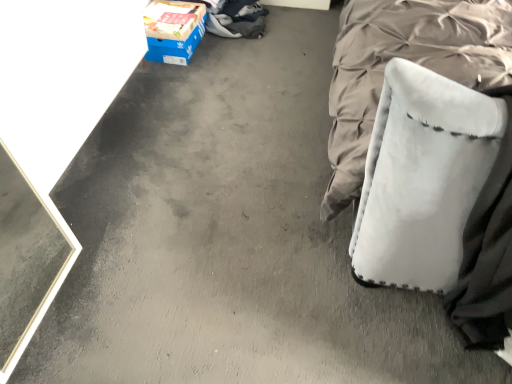
Question: Can you confirm if white fabric swivel chair at right is bigger than blue cardboard box at upper left?

Choices:
 (A) no
 (B) yes

Answer: (B)

Question: Does white fabric swivel chair at right come in front of blue cardboard box at upper left?

Choices:
 (A) yes
 (B) no

Answer: (A)

Question: Does white fabric swivel chair at right lie behind blue cardboard box at upper left?

Choices:
 (A) yes
 (B) no

Answer: (B)

Question: Is white fabric swivel chair at right touching blue cardboard box at upper left?

Choices:
 (A) no
 (B) yes

Answer: (A)

Question: Is white fabric swivel chair at right smaller than blue cardboard box at upper left?

Choices:
 (A) no
 (B) yes

Answer: (A)

Question: From the image's perspective, is white fabric swivel chair at right above blue cardboard box at upper left?

Choices:
 (A) no
 (B) yes

Answer: (A)

Question: Does blue cardboard box at upper left come in front of white fabric swivel chair at right?

Choices:
 (A) yes
 (B) no

Answer: (B)

Question: Considering the relative sizes of blue cardboard box at upper left and white fabric swivel chair at right in the image provided, is blue cardboard box at upper left wider than white fabric swivel chair at right?

Choices:
 (A) no
 (B) yes

Answer: (A)

Question: From the image's perspective, does blue cardboard box at upper left appear lower than white fabric swivel chair at right?

Choices:
 (A) yes
 (B) no

Answer: (B)

Question: Is blue cardboard box at upper left turned away from white fabric swivel chair at right?

Choices:
 (A) no
 (B) yes

Answer: (A)

Question: Is blue cardboard box at upper left taller than white fabric swivel chair at right?

Choices:
 (A) yes
 (B) no

Answer: (B)

Question: Can you confirm if blue cardboard box at upper left is thinner than white fabric swivel chair at right?

Choices:
 (A) no
 (B) yes

Answer: (B)

Question: From the image's perspective, is blue cardboard box at upper left located above or below white fabric swivel chair at right?

Choices:
 (A) below
 (B) above

Answer: (B)